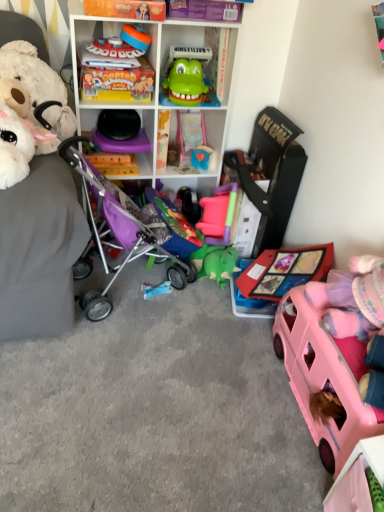
Question: In terms of height, does purple fabric baby carriage at left look taller or shorter compared to matte plastic game controller at upper center, the 2th toy in the left-to-right sequence?

Choices:
 (A) tall
 (B) short

Answer: (A)

Question: From a real-world perspective, is purple fabric baby carriage at left above or below matte plastic game controller at upper center, which is the 6th toy in right-to-left order?

Choices:
 (A) above
 (B) below

Answer: (B)

Question: Based on their relative distances, which object is farther from the white plastic shelf at upper center?

Choices:
 (A) blue matte toy at center, the second toy viewed from the right
 (B) pink plastic car at lower right, positioned as the 7th toy in left-to-right order
 (C) matte plastic game controller at upper center, the 2th toy in the left-to-right sequence
 (D) matte plastic toy at upper center, which appears as the fifth toy when viewed from the right
 (E) green plastic toy at upper center, marked as the fifth toy in a left-to-right arrangement

Answer: (B)

Question: Estimate the real-world distances between objects in this image. Which object is closer to the matte plastic game controller at upper center, the 2th toy in the left-to-right sequence?

Choices:
 (A) purple fabric baby carriage at left
 (B) blue matte toy at center, the second toy viewed from the right
 (C) white plastic shelf at upper center
 (D) matte yellow book at upper center
 (E) green plastic toy at upper center, marked as the fifth toy in a left-to-right arrangement

Answer: (D)